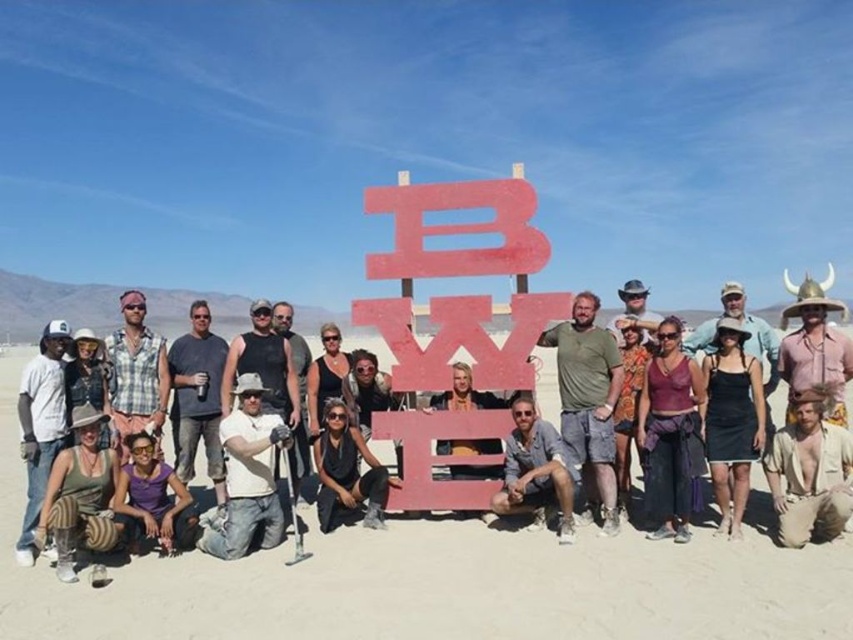
Does matte concrete sign at center have a smaller size compared to black fabric dress at lower right?

Actually, matte concrete sign at center might be larger than black fabric dress at lower right.

Describe the element at coordinates (437, 582) in the screenshot. This screenshot has width=853, height=640. I see `matte concrete sign at center` at that location.

Identify the location of matte concrete sign at center. The height and width of the screenshot is (640, 853). (437, 582).

Who is shorter, green matte shirt at center or gray cotton t-shirt at center?

With less height is gray cotton t-shirt at center.

Consider the image. Is green matte shirt at center further to the viewer compared to gray cotton t-shirt at center?

No, green matte shirt at center is in front of gray cotton t-shirt at center.

Which is behind, point (593, 468) or point (184, 342)?

Positioned behind is point (184, 342).

Identify the location of green matte shirt at center. (589, 397).

In the scene shown: Is green matte shirt at center above green fabric pants at lower left?

Yes.

Does green matte shirt at center have a greater width compared to green fabric pants at lower left?

Yes, green matte shirt at center is wider than green fabric pants at lower left.

This screenshot has width=853, height=640. I want to click on green matte shirt at center, so click(x=589, y=397).